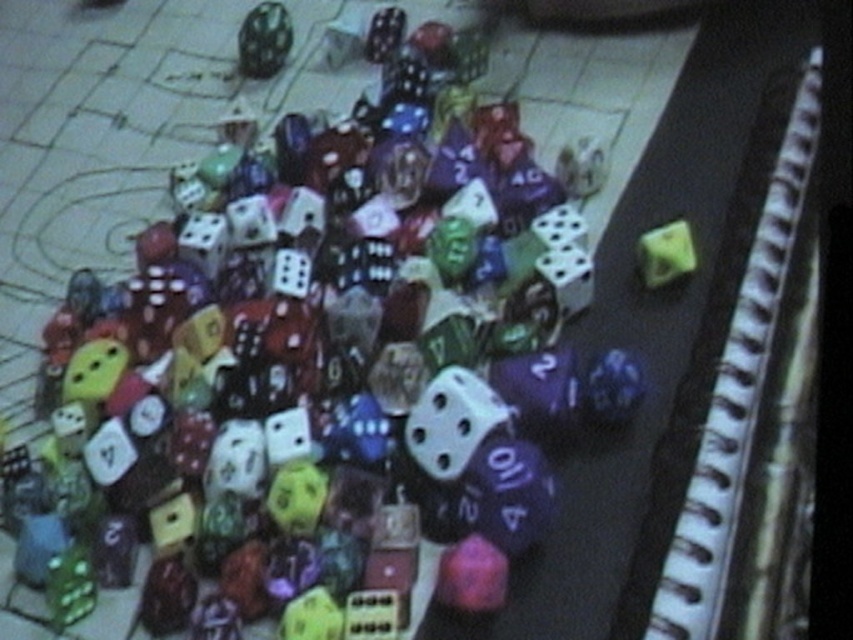
Question: Among these points, which one is farthest from the camera?

Choices:
 (A) (665, 273)
 (B) (276, 51)

Answer: (B)

Question: Can you confirm if matte black dice at upper center is positioned below matte green die at upper right?

Choices:
 (A) yes
 (B) no

Answer: (B)

Question: Considering the relative positions of matte black dice at upper center and matte green die at upper right in the image provided, where is matte black dice at upper center located with respect to matte green die at upper right?

Choices:
 (A) left
 (B) right

Answer: (A)

Question: Does matte black dice at upper center come in front of matte green die at upper right?

Choices:
 (A) no
 (B) yes

Answer: (A)

Question: Which of the following is the closest to the observer?

Choices:
 (A) (257, 65)
 (B) (645, 237)

Answer: (B)